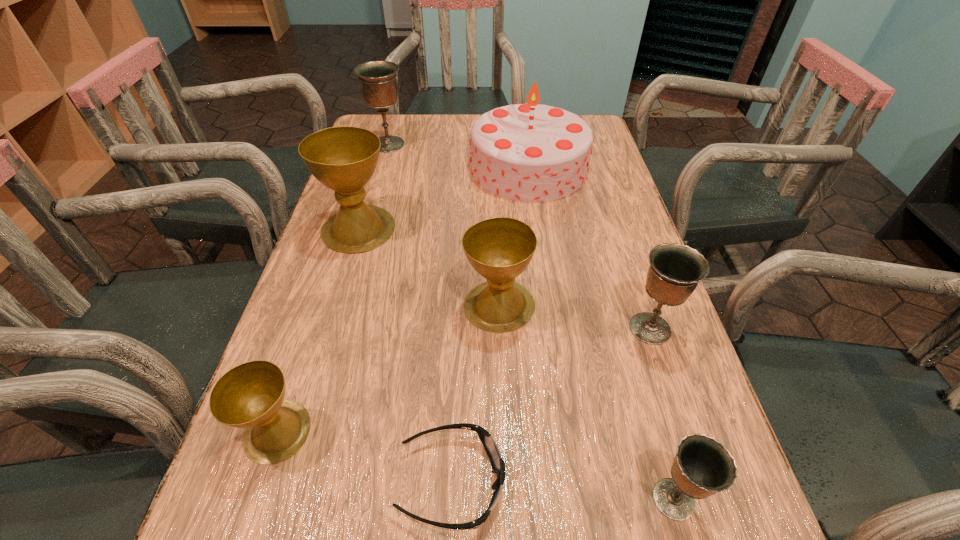
Find the location of a particular element. The image size is (960, 540). the nearest chalice is located at coordinates (703, 466).

Identify the location of the smallest bronze chalice. (703, 466).

Identify the location of the shortest object. (498, 465).

At what (x,y) coordinates should I click in order to perform the action: click on vacant area situated on the front of the birthday cake. Please return your answer as a coordinate pair (x, y). The width and height of the screenshot is (960, 540). Looking at the image, I should click on (544, 279).

You are a GUI agent. You are given a task and a screenshot of the screen. Output one action in this format:
    pyautogui.click(x=<x>, y=<y>)
    Task: Click on the blank space located 0.280m on the back of the fifth nearest chalice
    This screenshot has width=960, height=540.
    Given the screenshot: What is the action you would take?
    tap(382, 149)

The width and height of the screenshot is (960, 540). I want to click on free space located on the right of the farthest bronze chalice, so click(490, 144).

Where is `vacant region located on the back of the rightmost brown chalice`? vacant region located on the back of the rightmost brown chalice is located at coordinates (496, 240).

Where is `vacant region located on the left of the second farthest bronze chalice`? vacant region located on the left of the second farthest bronze chalice is located at coordinates (527, 328).

Identify the location of vacant space situated on the right of the smallest brown chalice. The height and width of the screenshot is (540, 960). (551, 431).

Locate an element on the screen. The width and height of the screenshot is (960, 540). vacant region located 0.360m on the back of the nearest chalice is located at coordinates (615, 296).